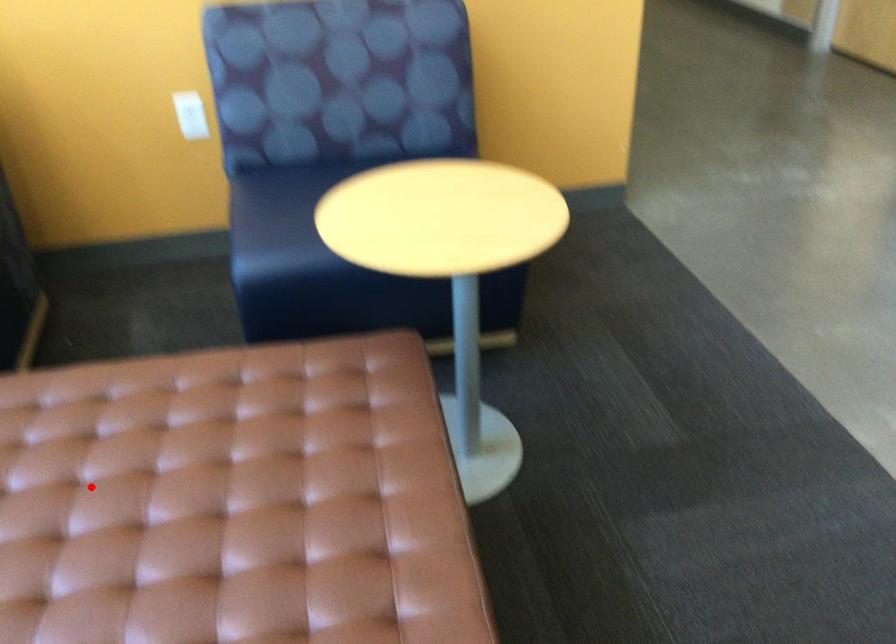
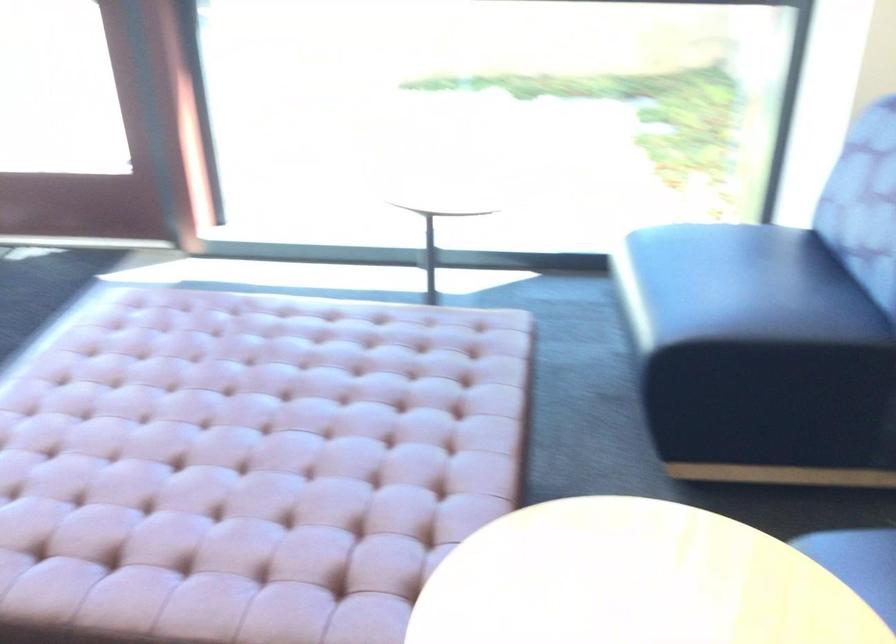
Question: A red point is marked in image1. In image2, is the corresponding 3D point closer to the camera or farther? Reply with the corresponding letter.

Choices:
 (A) The corresponding 3D point is closer.
 (B) The corresponding 3D point is farther.

Answer: (B)